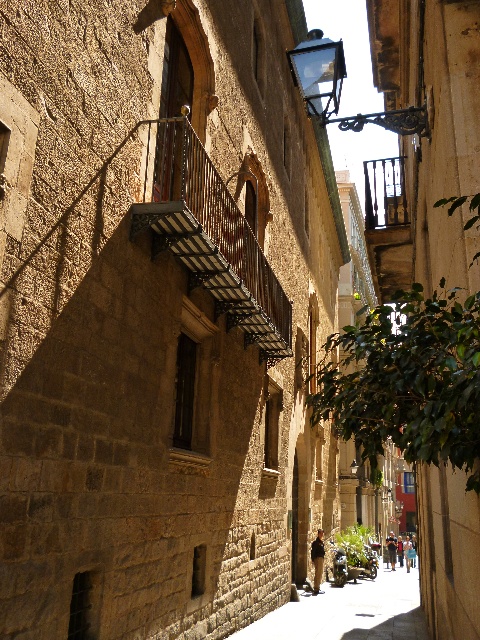
Which is above, black wrought iron balcony at center or wooden at upper center?

wooden at upper center

Who is taller, black wrought iron balcony at center or wooden at upper center?

Standing taller between the two is wooden at upper center.

Who is more distant from viewer, (181, 173) or (385, 160)?

The point (385, 160) is more distant.

Identify the location of black wrought iron balcony at center. The height and width of the screenshot is (640, 480). (211, 236).

Which is more to the right, black wrought iron balcony at center or clear glass lantern at upper center?

clear glass lantern at upper center is more to the right.

Who is higher up, black wrought iron balcony at center or clear glass lantern at upper center?

clear glass lantern at upper center is above.

Which is in front, point (238, 275) or point (424, 131)?

Point (424, 131) is more forward.

Locate an element on the screen. black wrought iron balcony at center is located at coordinates (211, 236).

Between smooth stone alley at center and wooden at upper center, which one is positioned lower?

smooth stone alley at center is lower down.

Is smooth stone alley at center closer to camera compared to wooden at upper center?

Yes, it is.

Locate an element on the screen. Image resolution: width=480 pixels, height=640 pixels. smooth stone alley at center is located at coordinates (348, 611).